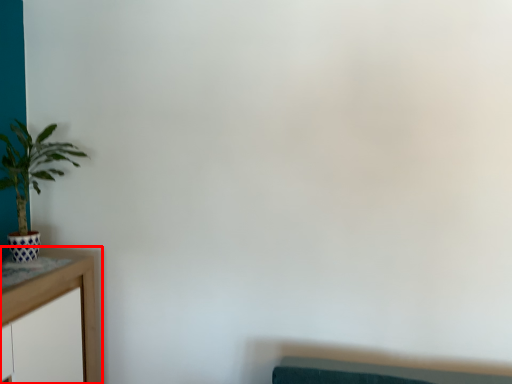
Question: Considering the relative positions of table (annotated by the red box) and houseplant in the image provided, where is table (annotated by the red box) located with respect to the staircase?

Choices:
 (A) right
 (B) left

Answer: (B)